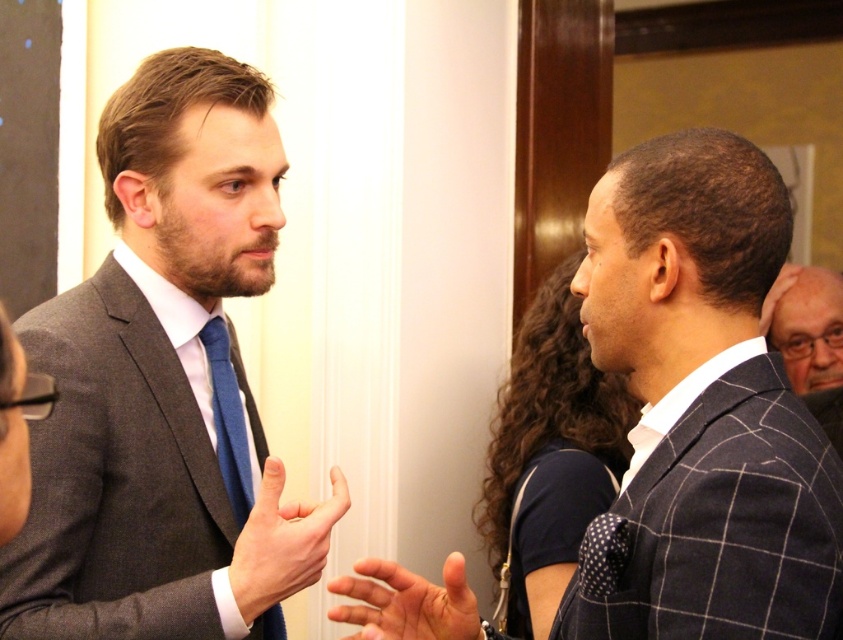
You are a photographer positioned at the center of the room. You want to take a photo of the dark blue checkered suit at right. Which direction should you move to get a better angle?

The dark blue checkered suit at right is located at coordinate point 0.641 on the x axis and 0.833 on the y axis. Since you are at the center, you should move towards the right and slightly upwards to align with the subject.

You are a photographer at a formal event. You need to capture a clear photo of both the dark blue checkered suit at right and the blue silk tie at center. Since the camera can only focus on one object at a time, which object should you focus on to ensure the other is still in the background?

The dark blue checkered suit at right is closer to the viewer than the blue silk tie at center. To ensure the blue silk tie at center remains in the background, focus on the dark blue checkered suit at right.